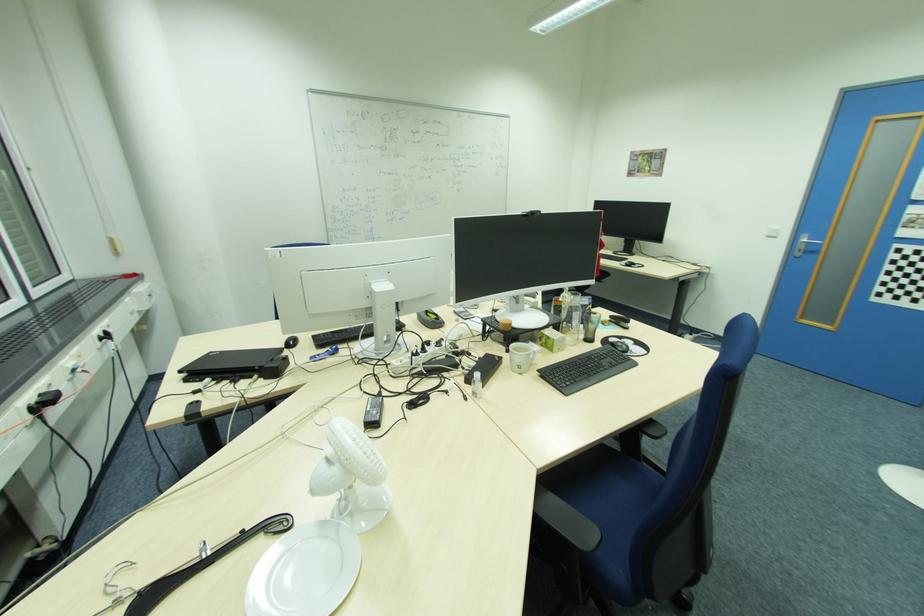
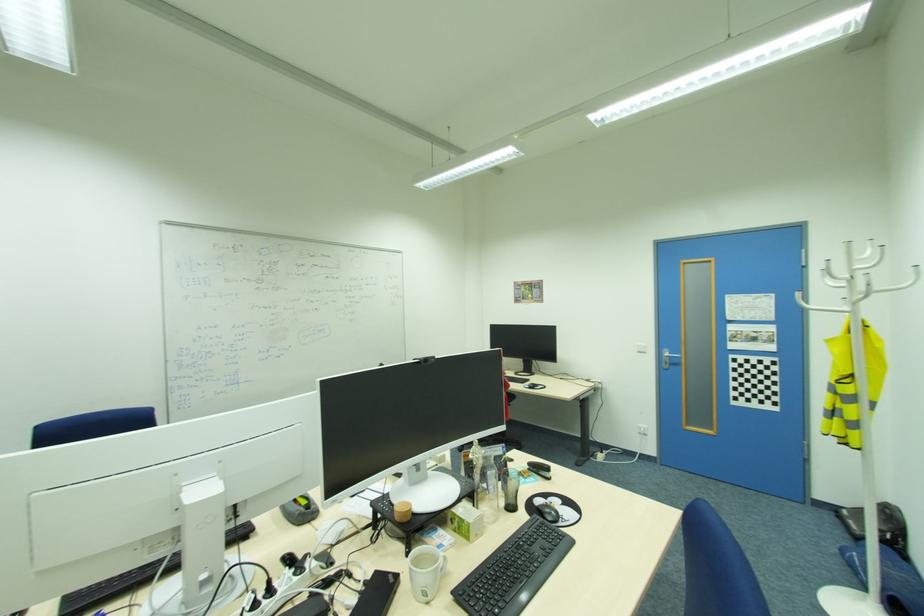
The images are taken continuously from a first-person perspective. In which direction are you moving?

The cameraman walked toward right, forward.